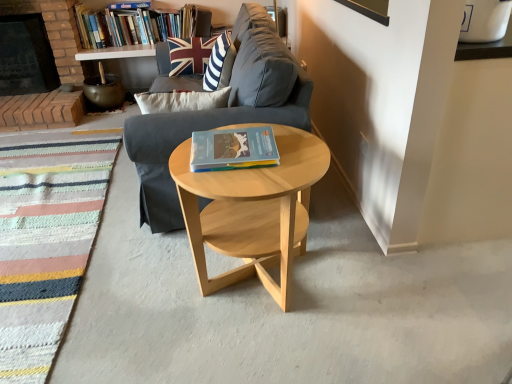
Question: Is hardcover book at upper center, the first book positioned from the left, to the right of hardcover book at center, which is counted as the second book, starting from the top, from the viewer's perspective?

Choices:
 (A) no
 (B) yes

Answer: (A)

Question: From the image's perspective, would you say hardcover book at upper center, placed as the 2th book when sorted from bottom to top, is shown under hardcover book at center, the 1th book viewed from the right?

Choices:
 (A) no
 (B) yes

Answer: (A)

Question: Is hardcover book at upper center, placed as the 2th book when sorted from bottom to top, wider than hardcover book at center, which is counted as the second book, starting from the top?

Choices:
 (A) no
 (B) yes

Answer: (A)

Question: From the image's perspective, is hardcover book at upper center, which is the 2th book in right-to-left order, on top of hardcover book at center, the second book from the left?

Choices:
 (A) no
 (B) yes

Answer: (B)

Question: Are hardcover book at upper center, placed as the 2th book when sorted from bottom to top, and hardcover book at center, the 1th book viewed from the right, far apart?

Choices:
 (A) yes
 (B) no

Answer: (A)

Question: Considering the relative sizes of hardcover book at upper center, placed as the 2th book when sorted from bottom to top, and hardcover book at center, which is counted as the second book, starting from the top, in the image provided, is hardcover book at upper center, placed as the 2th book when sorted from bottom to top, smaller than hardcover book at center, which is counted as the second book, starting from the top,?

Choices:
 (A) no
 (B) yes

Answer: (A)

Question: Is striped fabric rug at lower left aimed at brick fireplace at left?

Choices:
 (A) no
 (B) yes

Answer: (A)

Question: Is striped fabric rug at lower left not near brick fireplace at left?

Choices:
 (A) yes
 (B) no

Answer: (A)

Question: From a real-world perspective, is striped fabric rug at lower left physically above brick fireplace at left?

Choices:
 (A) yes
 (B) no

Answer: (B)

Question: Does striped fabric rug at lower left have a smaller size compared to brick fireplace at left?

Choices:
 (A) no
 (B) yes

Answer: (B)

Question: From the image's perspective, is striped fabric rug at lower left below brick fireplace at left?

Choices:
 (A) no
 (B) yes

Answer: (B)

Question: Is striped fabric rug at lower left facing away from brick fireplace at left?

Choices:
 (A) yes
 (B) no

Answer: (B)

Question: Can we say striped fabric rug at lower left lies outside hardcover book at center, which is counted as the second book, starting from the top?

Choices:
 (A) yes
 (B) no

Answer: (A)